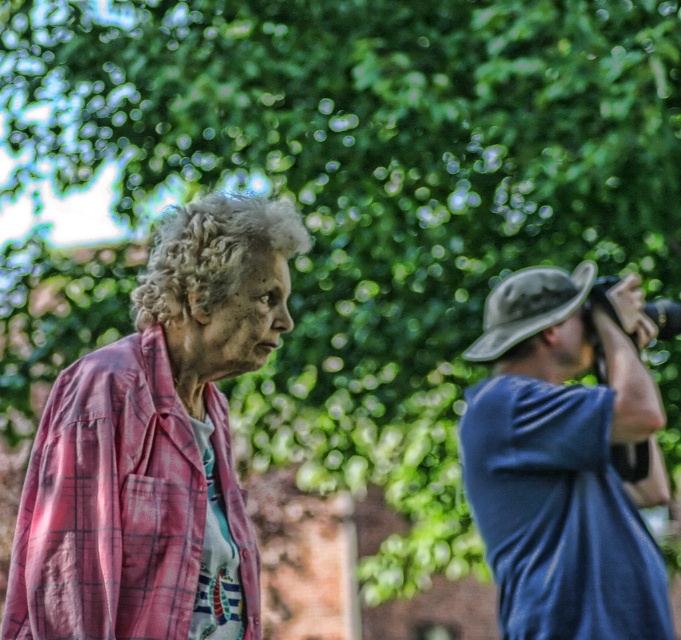
You are a photographer standing between the pink plaid shirt at left and the blue fabric hat at upper right. You need to move 2 meters closer to the subject. Is there enough space between you and the subject to move forward?

The distance between the pink plaid shirt at left and the blue fabric hat at upper right is 1.79 meters. Moving 2 meters closer would require more space than available, so you cannot move forward that much.

You are standing in front of the scene and want to know which of the two points, point (101, 360) or point (550, 632), is nearer to you. Based on the spatial arrangement, which point is closer?

Point (101, 360) is closer to the viewer than point (550, 632).